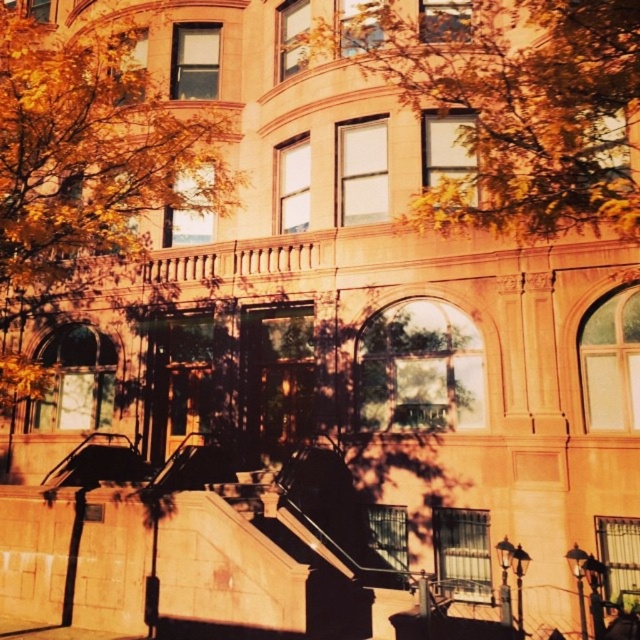
Is yellow leafy tree at upper center closer to the viewer compared to golden textured leaves at center?

No, it is behind golden textured leaves at center.

Consider the image. Which is below, yellow leafy tree at upper center or golden textured leaves at center?

Positioned lower is yellow leafy tree at upper center.

Does point (483, 116) lie in front of point (26, 244)?

No, it is not.

The width and height of the screenshot is (640, 640). In order to click on yellow leafy tree at upper center in this screenshot , I will do `click(515, 106)`.